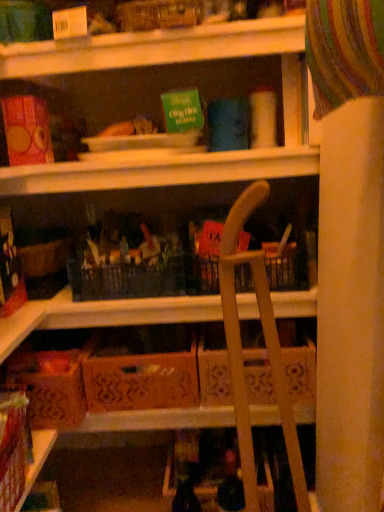
Question: Considering the relative positions of wooden folding chair at center and orange cardboard box at center, marked as the 1th cardboard box in a right-to-left arrangement, in the image provided, is wooden folding chair at center to the left or to the right of orange cardboard box at center, marked as the 1th cardboard box in a right-to-left arrangement,?

Choices:
 (A) left
 (B) right

Answer: (B)

Question: Is wooden folding chair at center spatially inside orange cardboard box at center, which is counted as the 2th cardboard box, starting from the left, or outside of it?

Choices:
 (A) outside
 (B) inside

Answer: (A)

Question: Which object is the farthest from the orange cardboard box at center, which is counted as the 2th cardboard box, starting from the left?

Choices:
 (A) brown cardboard box at lower left, the 2th cardboard box when ordered from right to left
 (B) wooden folding chair at center

Answer: (B)

Question: Which of these objects is positioned farthest from the brown cardboard box at lower left, the 2th cardboard box when ordered from right to left?

Choices:
 (A) wooden folding chair at center
 (B) orange cardboard box at center, marked as the 1th cardboard box in a right-to-left arrangement

Answer: (A)